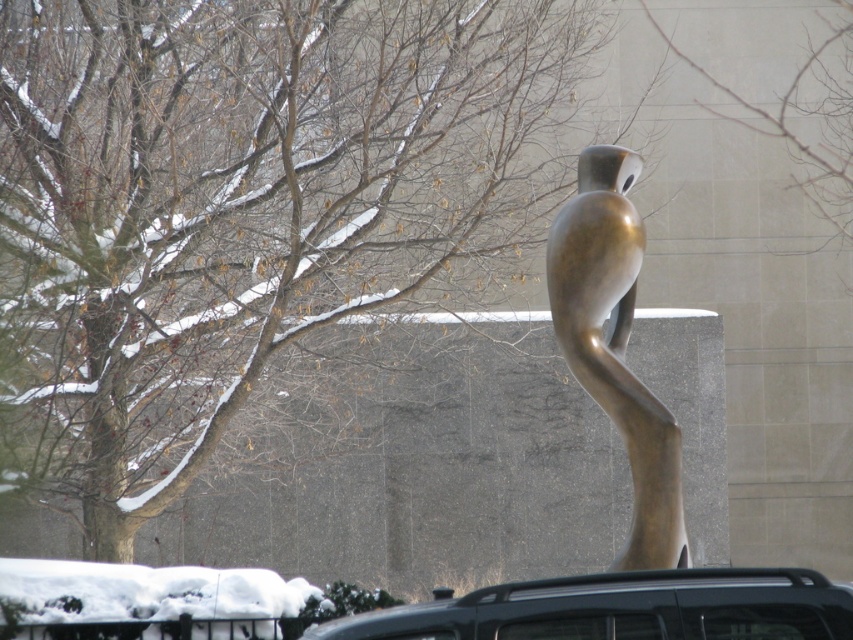
You are a delivery person standing next to the black matte car at lower center. You need to place a package on the bronze sculpture at center. Can you reach it without moving from your current position?

The distance between the black matte car at lower center and the bronze sculpture at center is 3.38 meters. Since you are standing next to the car, you would need to move closer to the sculpture to place the package, as 3.38 meters is beyond typical arm reach.

You are a delivery person needing to park your black matte car at lower center near the bronze sculpture at center. According to the scene description, can you park the car directly in front of the sculpture?

The black matte car at lower center is to the right of bronze sculpture at center, so parking directly in front would require moving it to the left to align with the sculpture.